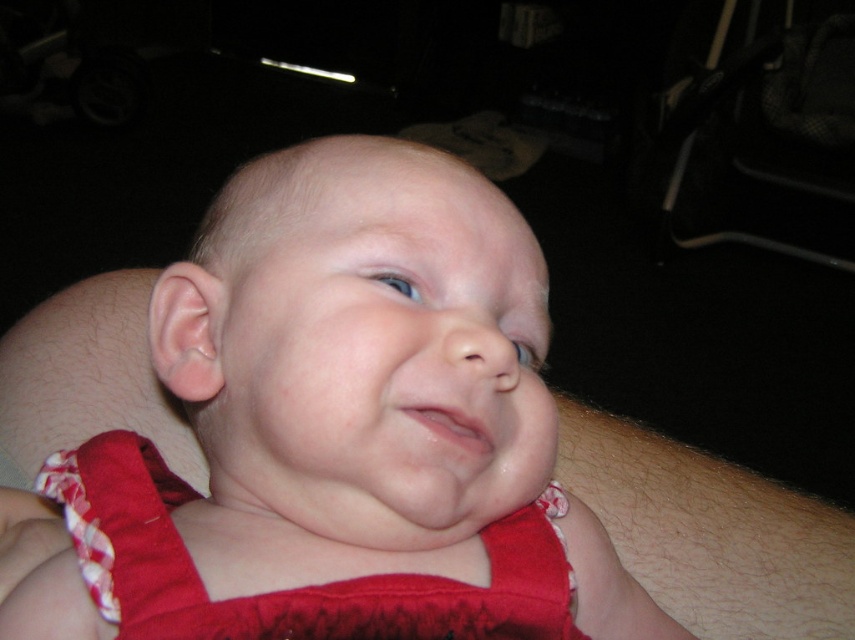
Question: Observing the image, what is the correct spatial positioning of red fabric baby at center in reference to red satin dress at center?

Choices:
 (A) below
 (B) above

Answer: (B)

Question: Can you confirm if red fabric baby at center is positioned above red satin dress at center?

Choices:
 (A) yes
 (B) no

Answer: (A)

Question: Is red fabric baby at center wider than red satin dress at center?

Choices:
 (A) no
 (B) yes

Answer: (B)